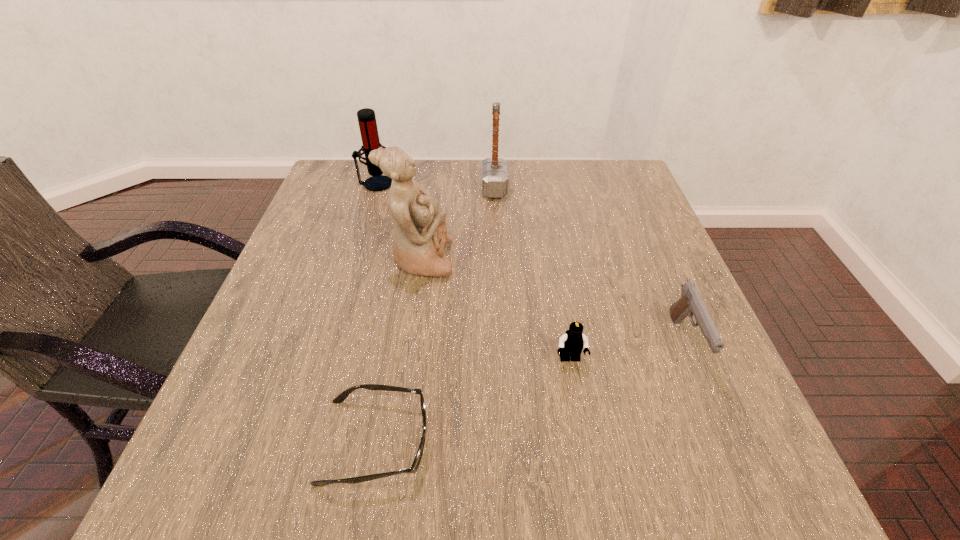
Where is `object that is at the far left corner`? object that is at the far left corner is located at coordinates (366, 117).

The width and height of the screenshot is (960, 540). What are the coordinates of `vacant space at the far edge of the desktop` in the screenshot? It's located at (500, 204).

Where is `vacant position at the left edge of the desktop`? This screenshot has height=540, width=960. vacant position at the left edge of the desktop is located at coordinates (306, 267).

Find the location of a particular element. This screenshot has width=960, height=540. vacant space at the right edge of the desktop is located at coordinates (648, 265).

At what (x,y) coordinates should I click in order to perform the action: click on free space at the far left corner. Please return your answer as a coordinate pair (x, y). The height and width of the screenshot is (540, 960). Looking at the image, I should click on (350, 191).

You are a GUI agent. You are given a task and a screenshot of the screen. Output one action in this format:
    pyautogui.click(x=<x>, y=<y>)
    Task: Click on the vacant space at the near left corner of the desktop
    This screenshot has height=540, width=960.
    Given the screenshot: What is the action you would take?
    pyautogui.click(x=193, y=474)

The image size is (960, 540). Find the location of `vacant area between the hammer and the nearest object`. vacant area between the hammer and the nearest object is located at coordinates (435, 315).

Where is `empty space that is in between the pistol and the microphone`? empty space that is in between the pistol and the microphone is located at coordinates (530, 263).

Where is `free area in between the fourth nearest object and the Lego`? free area in between the fourth nearest object and the Lego is located at coordinates (495, 309).

The height and width of the screenshot is (540, 960). I want to click on vacant space that is in between the hammer and the microphone, so click(x=435, y=186).